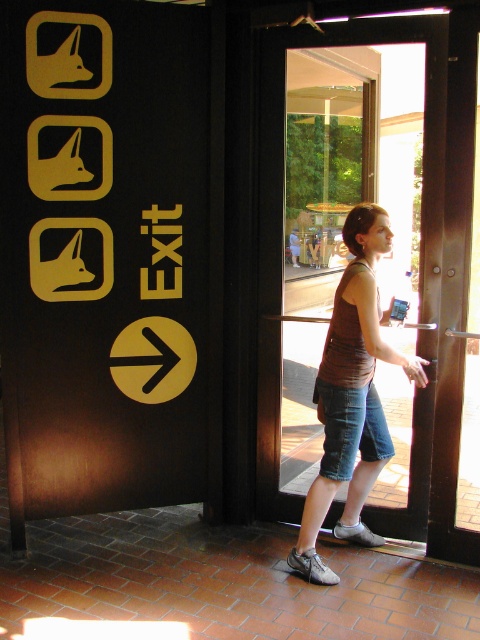
Question: Which point is closer to the camera?

Choices:
 (A) matte black sign at exit right
 (B) brown fabric tank top at center
 (C) transparent glass door at center

Answer: (B)

Question: Which point is farther to the camera?

Choices:
 (A) transparent glass door at center
 (B) matte black sign at exit right
 (C) brown fabric tank top at center

Answer: (A)

Question: Does transparent glass door at center have a smaller size compared to brown fabric tank top at center?

Choices:
 (A) yes
 (B) no

Answer: (B)

Question: Which point appears closest to the camera in this image?

Choices:
 (A) (43, 124)
 (B) (383, 381)
 (C) (343, 531)

Answer: (A)

Question: Does matte black sign at exit right appear under brown fabric tank top at center?

Choices:
 (A) yes
 (B) no

Answer: (B)

Question: Is matte black sign at exit right to the right of brown fabric tank top at center from the viewer's perspective?

Choices:
 (A) yes
 (B) no

Answer: (B)